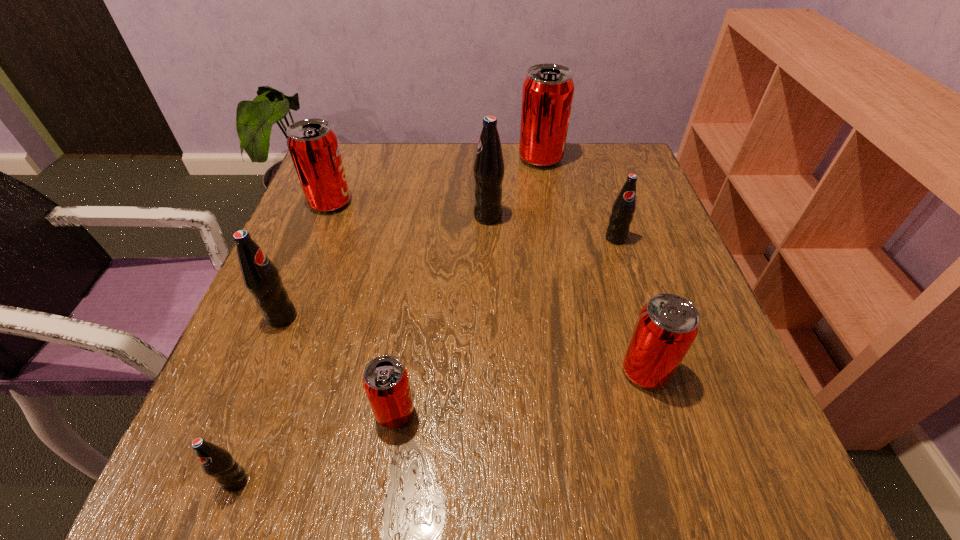
Identify the location of vacant space that is in between the farthest pop and the third nearest black pop. The height and width of the screenshot is (540, 960). (578, 199).

What are the coordinates of `free space between the fifth farthest pop and the leftmost red soda can` in the screenshot? It's located at (306, 260).

In order to click on object that ranks as the fourth closest to the farthest object in this screenshot , I will do `click(668, 324)`.

This screenshot has height=540, width=960. I want to click on object that can be found as the closest to the sixth pop from left to right, so click(488, 168).

At what (x,y) coordinates should I click in order to perform the action: click on the closest pop to the farthest object. Please return your answer as a coordinate pair (x, y). Image resolution: width=960 pixels, height=540 pixels. Looking at the image, I should click on (488, 168).

Identify the location of pop that is the second closest to the biggest black pop. This screenshot has height=540, width=960. (624, 207).

The width and height of the screenshot is (960, 540). Find the location of `red soda can that is the third closest to the sixth pop from left to right`. red soda can that is the third closest to the sixth pop from left to right is located at coordinates (385, 380).

I want to click on the closest red soda can to the smallest red soda can, so click(x=668, y=324).

The height and width of the screenshot is (540, 960). I want to click on black pop that is the third closest one to the biggest red soda can, so pyautogui.click(x=261, y=277).

Select which black pop appears as the closest to the fifth pop from left to right. Please provide its 2D coordinates. Your answer should be formatted as a tuple, i.e. [(x, y)], where the tuple contains the x and y coordinates of a point satisfying the conditions above.

[(624, 207)]